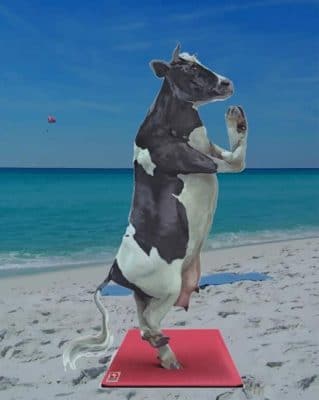
The image size is (319, 400). In order to click on pink yoga mat in this screenshot , I will do `click(220, 373)`.